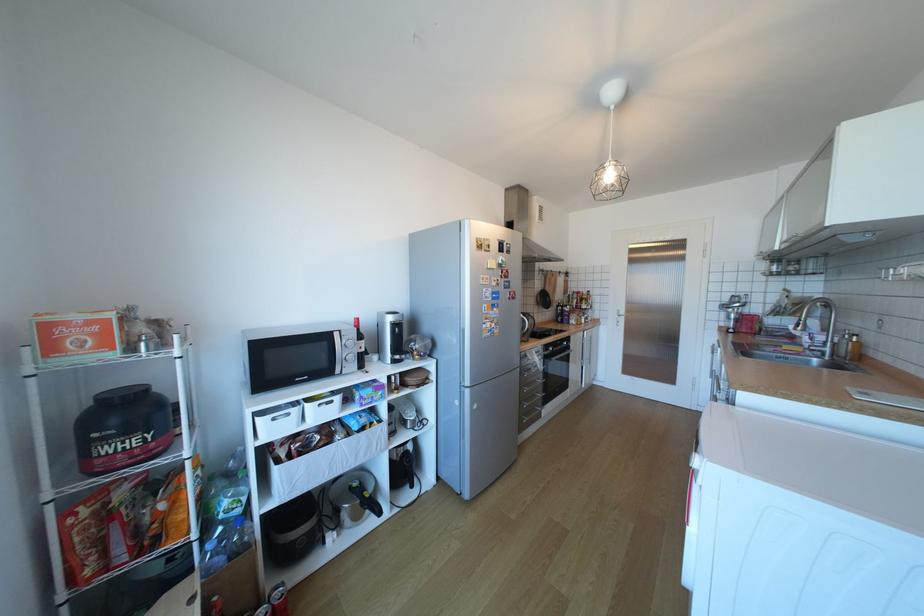
What do you see at coordinates (348, 341) in the screenshot?
I see `a microwave control knob` at bounding box center [348, 341].